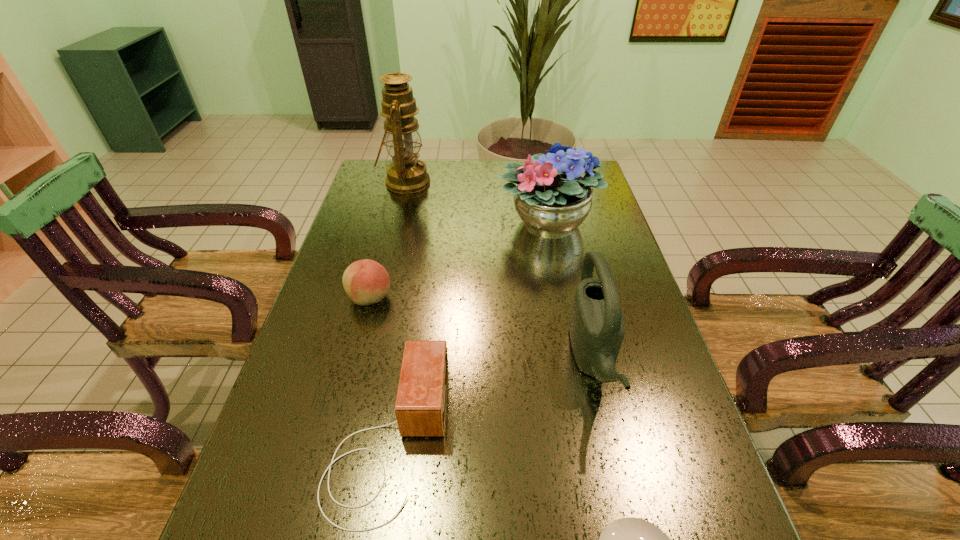
What are the coordinates of `vacant space at the left edge` in the screenshot? It's located at (387, 219).

The image size is (960, 540). Identify the location of free space at the right edge of the desktop. (626, 341).

Where is `free point between the watering can and the radio receiver`? The image size is (960, 540). free point between the watering can and the radio receiver is located at coordinates (491, 399).

Locate an element on the screen. The image size is (960, 540). vacant space that's between the bouquet and the oil lamp is located at coordinates (476, 203).

This screenshot has height=540, width=960. I want to click on vacant space that's between the radio receiver and the tallest object, so [396, 310].

Where is `vacant area that lies between the tallest object and the radio receiver`? vacant area that lies between the tallest object and the radio receiver is located at coordinates (396, 310).

Locate an element on the screen. This screenshot has width=960, height=540. unoccupied area between the watering can and the tallest object is located at coordinates (499, 271).

Image resolution: width=960 pixels, height=540 pixels. I want to click on vacant space that is in between the watering can and the oil lamp, so click(499, 271).

You are a GUI agent. You are given a task and a screenshot of the screen. Output one action in this format:
    pyautogui.click(x=<x>, y=<y>)
    Task: Click on the free point between the tallest object and the watering can
    Image resolution: width=960 pixels, height=540 pixels.
    Given the screenshot: What is the action you would take?
    pyautogui.click(x=499, y=271)

Find the location of a particular element. The image size is (960, 540). vacant space in between the radio receiver and the watering can is located at coordinates [x=491, y=399].